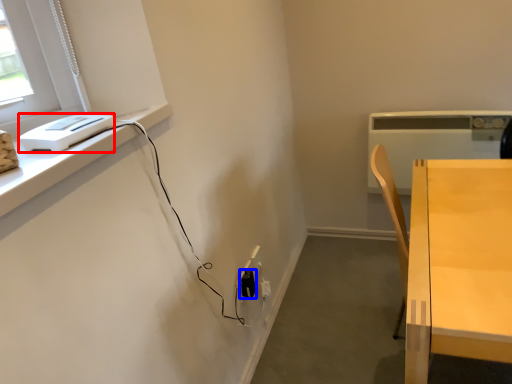
Question: Which object is further to the camera taking this photo, appliance (highlighted by a red box) or electric outlet (highlighted by a blue box)?

Choices:
 (A) appliance
 (B) electric outlet

Answer: (B)